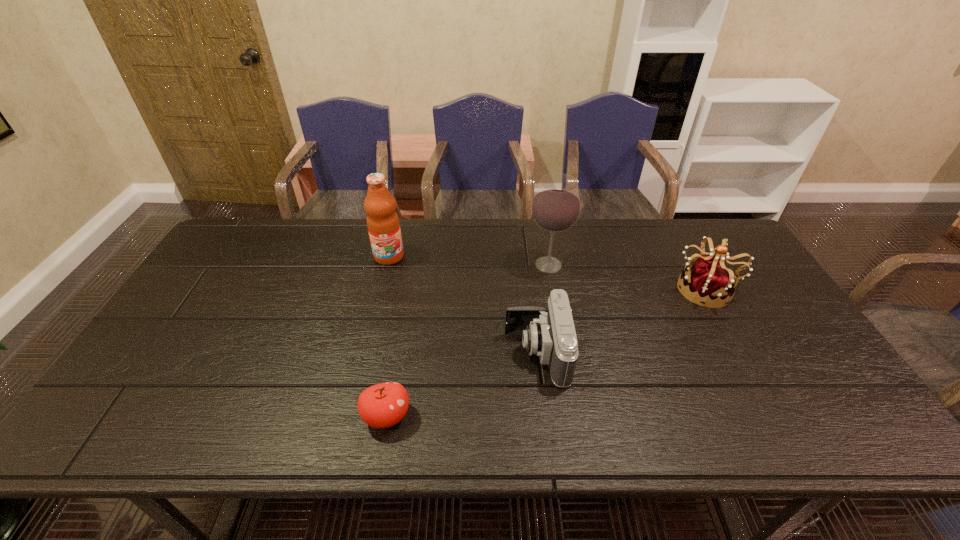
Locate an element on the screen. vacant space that's between the fourth farthest object and the third tallest object is located at coordinates (622, 321).

Image resolution: width=960 pixels, height=540 pixels. I want to click on free space between the fruit juice and the camera, so click(x=463, y=305).

Locate an element on the screen. This screenshot has height=540, width=960. free spot between the fruit juice and the alcohol is located at coordinates (468, 261).

Image resolution: width=960 pixels, height=540 pixels. In order to click on blank region between the nearest object and the alcohol in this screenshot , I will do `click(468, 341)`.

Locate an element on the screen. The image size is (960, 540). vacant space that's between the camera and the shortest object is located at coordinates (462, 385).

Identify which object is the nearest to the tiara. Please provide its 2D coordinates. Your answer should be formatted as a tuple, i.e. [(x, y)], where the tuple contains the x and y coordinates of a point satisfying the conditions above.

[(556, 206)]

Find the location of a particular element. The height and width of the screenshot is (540, 960). object identified as the closest to the shortest object is located at coordinates (549, 333).

I want to click on free space that satisfies the following two spatial constraints: 1. on the front label of the fruit juice; 2. on the right side of the shortest object, so click(350, 416).

Find the location of a particular element. The width and height of the screenshot is (960, 540). vacant area that satisfies the following two spatial constraints: 1. on the front label of the fruit juice; 2. on the left side of the nearest object is located at coordinates (350, 416).

Where is `vacant area in the image that satisfies the following two spatial constraints: 1. on the front label of the fruit juice; 2. on the right side of the nearest object`? vacant area in the image that satisfies the following two spatial constraints: 1. on the front label of the fruit juice; 2. on the right side of the nearest object is located at coordinates (350, 416).